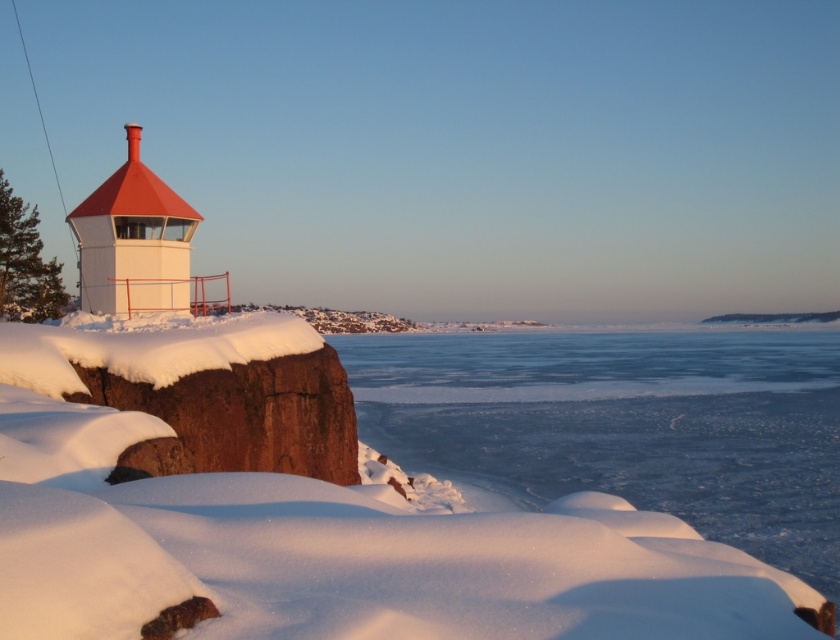
Measure the distance between frozen ice at lower center and matte white tower at left.

frozen ice at lower center is 85.09 meters from matte white tower at left.

Based on the photo, is frozen ice at lower center closer to camera compared to matte white tower at left?

That is True.

Measure the distance between frozen ice at lower center and camera.

frozen ice at lower center and camera are 30.27 feet apart.

Identify the location of frozen ice at lower center. The image size is (840, 640). (625, 426).